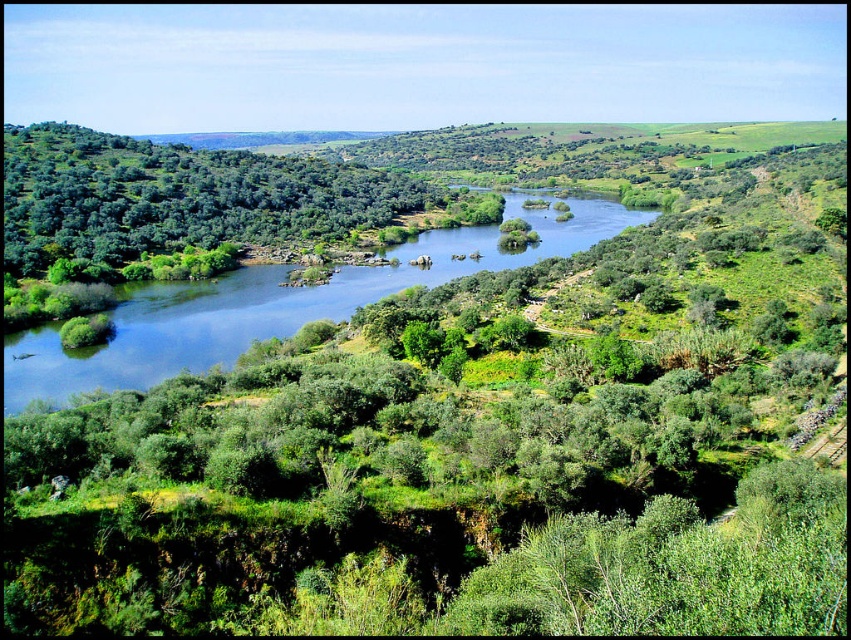
You are a bird soaring over the landscape. You see the green leafy trees at left and the blue water at center. Which object is located above the other?

The green leafy trees at left are positioned over the blue water at center.

You are standing at the point marked by the coordinates point (178, 196). Looking around, you see green leafy trees at left. Which direction should you face to see the green leafy trees at left?

You should face to the left to see the green leafy trees at left.